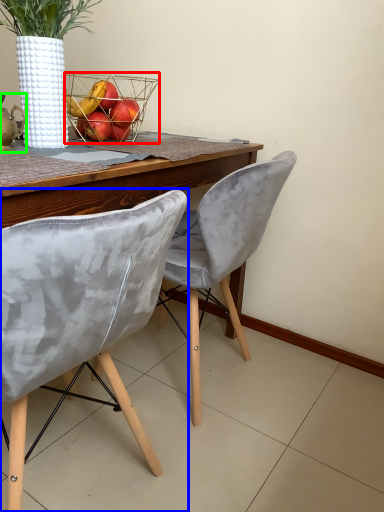
Question: Based on their relative distances, which object is nearer to basket (highlighted by a red box)? Choose from chair (highlighted by a blue box) and tea pot (highlighted by a green box).

Choices:
 (A) chair
 (B) tea pot

Answer: (B)